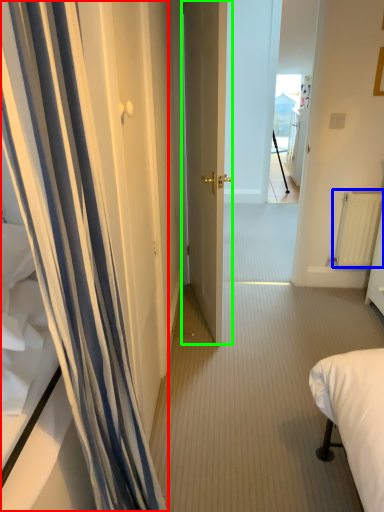
Question: Which object is the farthest from curtain (highlighted by a red box)? Choose among these: radiator (highlighted by a blue box) or door (highlighted by a green box).

Choices:
 (A) radiator
 (B) door

Answer: (A)